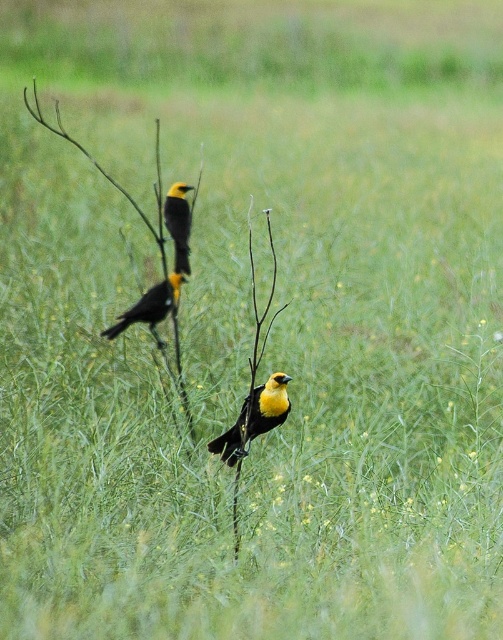
Question: Is yellow matte bird at center further to the viewer compared to yellow matte/black bird at upper center?

Choices:
 (A) no
 (B) yes

Answer: (A)

Question: Which object is farther from the camera taking this photo?

Choices:
 (A) yellow-feathered bird at center
 (B) yellow matte/black bird at upper center
 (C) yellow matte bird at center

Answer: (B)

Question: Can you confirm if yellow matte bird at center is wider than yellow-feathered bird at center?

Choices:
 (A) yes
 (B) no

Answer: (B)

Question: Does yellow matte bird at center appear on the right side of yellow matte/black bird at upper center?

Choices:
 (A) no
 (B) yes

Answer: (B)

Question: Among these objects, which one is nearest to the camera?

Choices:
 (A) yellow matte/black bird at upper center
 (B) yellow matte bird at center
 (C) yellow-feathered bird at center

Answer: (B)

Question: Among these points, which one is nearest to the camera?

Choices:
 (A) (186, 198)
 (B) (174, 301)
 (C) (218, 451)

Answer: (C)